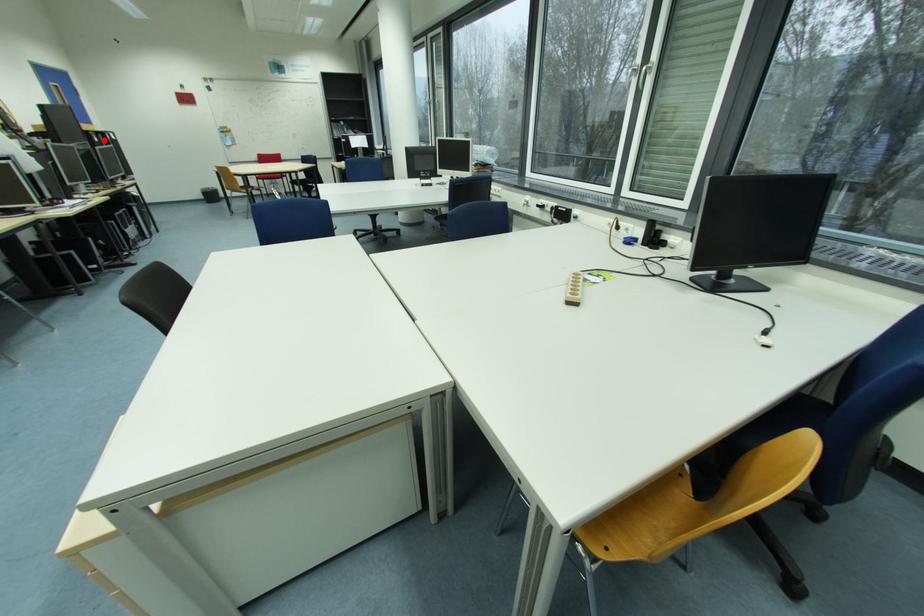
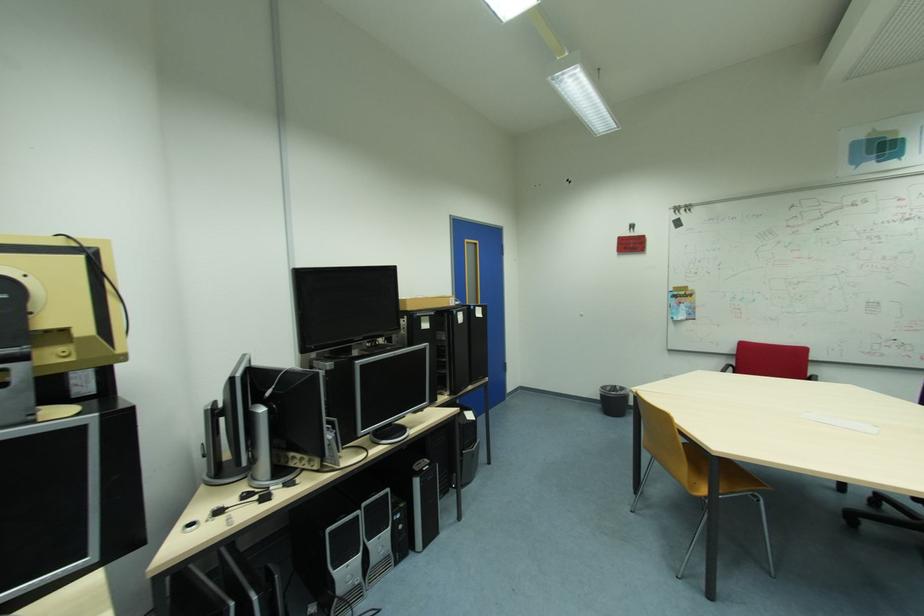
Locate, in the second image, the point that corresponds to the highlighted location in the first image.

(432, 326)